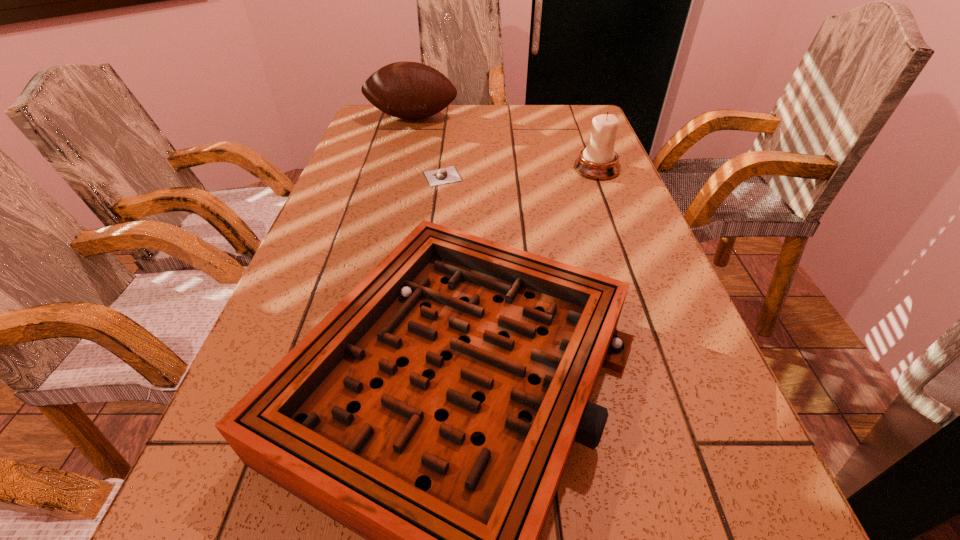
In the image, there is a desktop. Where is `free space at the far edge`? The image size is (960, 540). free space at the far edge is located at coordinates (433, 122).

Image resolution: width=960 pixels, height=540 pixels. Find the location of `vacant space at the left edge of the desktop`. vacant space at the left edge of the desktop is located at coordinates (387, 165).

The width and height of the screenshot is (960, 540). In the image, there is a desktop. Find the location of `vacant space at the right edge`. vacant space at the right edge is located at coordinates (658, 359).

At what (x,y) coordinates should I click in order to perform the action: click on vacant area at the far left corner of the desktop. Please return your answer as a coordinate pair (x, y). Looking at the image, I should click on (357, 132).

Locate an element on the screen. vacant area that lies between the football and the candle holder is located at coordinates (505, 144).

This screenshot has height=540, width=960. Find the location of `free point between the farthest object and the candle holder`. free point between the farthest object and the candle holder is located at coordinates (505, 144).

Identify the location of free space between the candle holder and the shortest object. (519, 173).

This screenshot has width=960, height=540. What are the coordinates of `vacant area that lies between the garlic and the farthest object` in the screenshot? It's located at (427, 147).

Find the location of `free space between the garlic and the candle holder`. free space between the garlic and the candle holder is located at coordinates (519, 173).

Find the location of a particular element. This screenshot has width=960, height=540. empty space between the football and the candle holder is located at coordinates (505, 144).